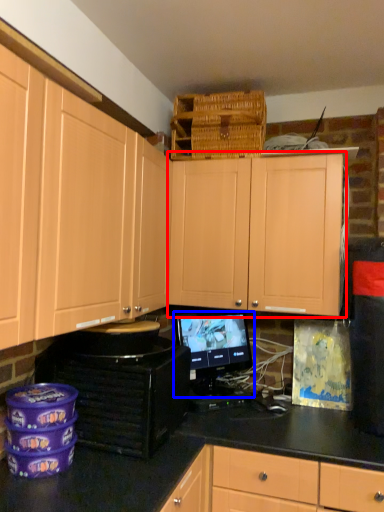
Question: Which of the following is the farthest to the observer, cabinetry (highlighted by a red box) or computer monitor (highlighted by a blue box)?

Choices:
 (A) cabinetry
 (B) computer monitor

Answer: (B)